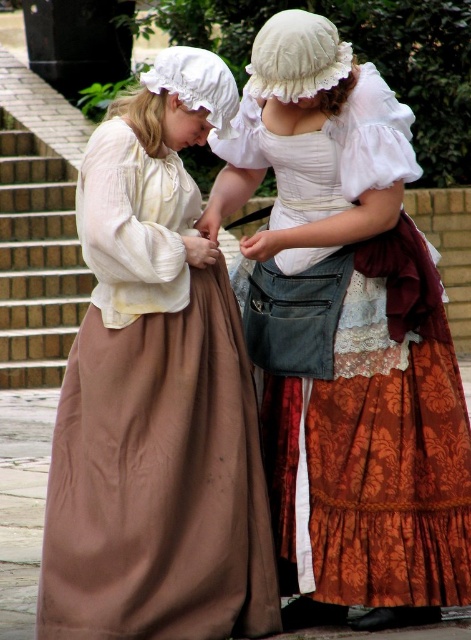
You are a tailor measuring fabric for alterations. You have a piece of fabric that is 1 meter wide. You need to decide whether it can cover the matte white blouse at center and the brick at left. Which object requires a wider fabric piece?

The matte white blouse at center might be wider than brick at left, so the matte white blouse at center requires a wider fabric piece.

Based on the scene described, which object, the matte white blouse at center or the matte brown skirt at center, extends higher upwards?

The matte white blouse at center is taller than the matte brown skirt at center, so the matte white blouse at center extends higher upwards.

You are standing in front of this historical scene. There are two points marked in the image. The first point is at coordinates point (x=204, y=561) and the second is at point (x=30, y=182). Which point is closer to you?

The point at coordinates point (x=204, y=561) is closer to you than the point at point (x=30, y=182).